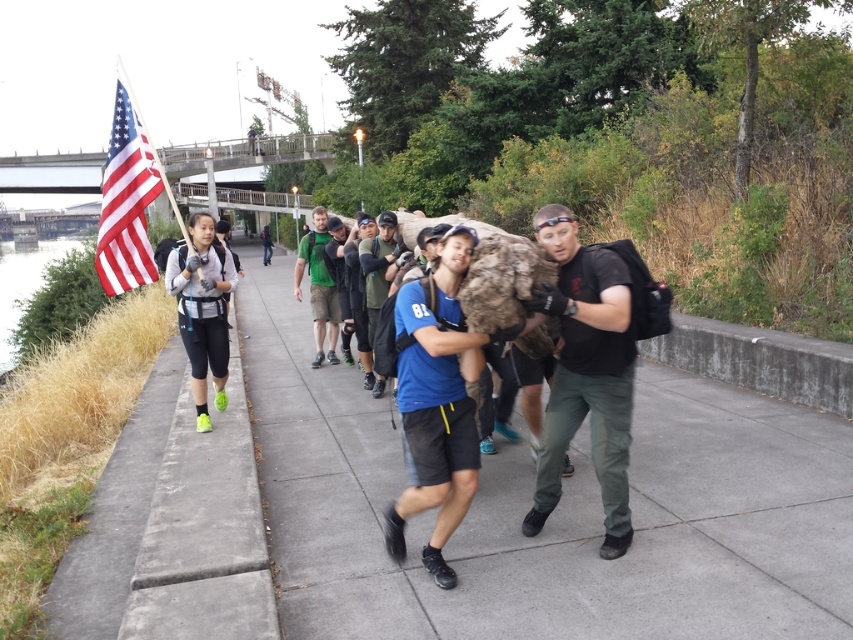
Is point (201, 390) positioned after point (323, 230)?

No, (201, 390) is closer to viewer.

You are a GUI agent. You are given a task and a screenshot of the screen. Output one action in this format:
    pyautogui.click(x=<x>, y=<y>)
    Task: Click on the matte black backpack at left
    The height and width of the screenshot is (640, 853).
    Given the screenshot: What is the action you would take?
    (x=202, y=308)

Locate an element on the screen. The width and height of the screenshot is (853, 640). matte black backpack at left is located at coordinates (202, 308).

Can you confirm if matte black backpack at left is taller than dark gray hoodie at center?

In fact, matte black backpack at left may be shorter than dark gray hoodie at center.

Does point (173, 272) come in front of point (263, 234)?

Yes, point (173, 272) is closer to viewer.

Image resolution: width=853 pixels, height=640 pixels. What are the coordinates of `matte black backpack at left` in the screenshot? It's located at (202, 308).

Between concrete sidewalk at center and green fabric shirt at center, which one is positioned lower?

concrete sidewalk at center

Is concrete sidewalk at center in front of green fabric shirt at center?

Yes, it is in front of green fabric shirt at center.

Does point (795, 611) come behind point (325, 285)?

No, it is in front of (325, 285).

Locate an element on the screen. concrete sidewalk at center is located at coordinates (552, 515).